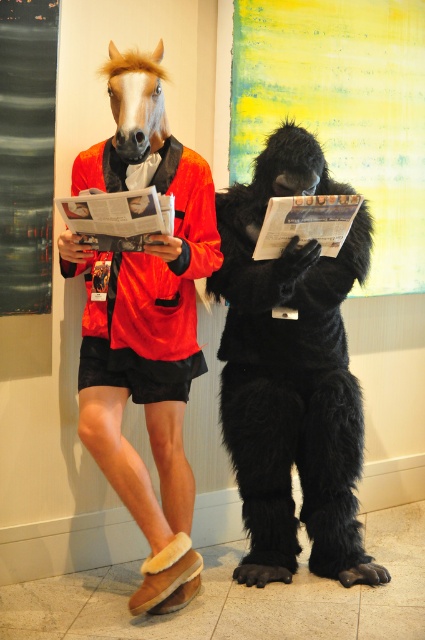
You are a photographer setting up for a photoshoot in a room with abstract paintings. You need to position two models wearing costumes. One is the black furry gorilla at center and the other is the matte black costume at left. According to the scene, which costume is on the right side of the other?

The black furry gorilla at center is positioned on the right side of the matte black costume at left.

You are standing in the room and want to place a new painting exactly at the point marked as point (144, 323). What object from the scene is already located there?

The matte black costume at left is located at point (144, 323).

You are taking a photo of two people in costumes. There are two points marked in the image. The first point is at coordinate point (81, 150) and the second point is at coordinate point (186, 228). Which point is closer to the camera?

Point (81, 150) is closer to the camera than point (186, 228) because it is further to the camera than the other point.